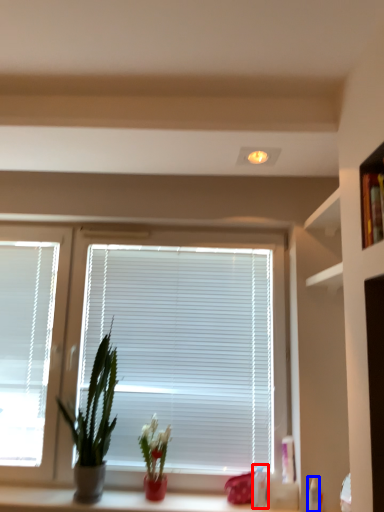
Question: Which point is closer to the camera, toiletry (highlighted by a red box) or toiletry (highlighted by a blue box)?

Choices:
 (A) toiletry
 (B) toiletry

Answer: (B)